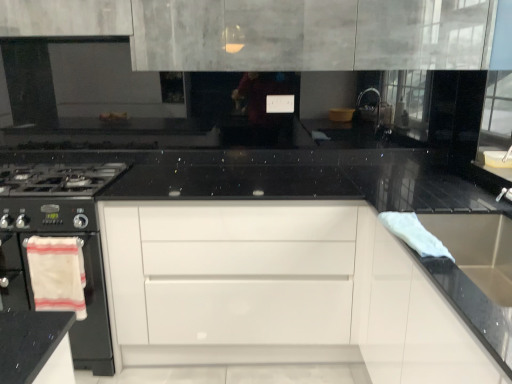
What is the approximate height of white cotton towel at left, which is the second material in right-to-left order?

The height of white cotton towel at left, which is the second material in right-to-left order, is 15.21 inches.

Locate an element on the screen. white glossy drawer at center is located at coordinates (249, 274).

Consider the image. Which object is thinner, white glossy drawer at center or stainless steel sink at right?

stainless steel sink at right.

Is white glossy drawer at center taller than stainless steel sink at right?

Correct, white glossy drawer at center is much taller as stainless steel sink at right.

Would you consider white glossy drawer at center to be distant from stainless steel sink at right?

No, there isn't a large distance between white glossy drawer at center and stainless steel sink at right.

Could you tell me if white glossy drawer at center is facing stainless steel sink at right?

No, white glossy drawer at center is not aimed at stainless steel sink at right.

In the scene shown: Is black matte gas stove at left next to white glossy drawer at center and touching it?

black matte gas stove at left is not next to white glossy drawer at center, and they're not touching.

Is black matte gas stove at left positioned before white glossy drawer at center?

Yes, it is.

Could you tell me if black matte gas stove at left is facing white glossy drawer at center?

No, black matte gas stove at left is not turned towards white glossy drawer at center.

Considering the sizes of objects black matte gas stove at left and white glossy drawer at center in the image provided, who is bigger, black matte gas stove at left or white glossy drawer at center?

white glossy drawer at center.

Is white cloth at right, the 2th material when ordered from left to right, positioned with its back to white glossy drawer at center?

No, white cloth at right, the 2th material when ordered from left to right, is not facing the opposite direction of white glossy drawer at center.

Consider the image. From a real-world perspective, is white cloth at right, the 1th material from the right, over white glossy drawer at center?

Yes.

Considering the relative positions of white cloth at right, the 1th material when ordered from front to back, and white glossy drawer at center in the image provided, is white cloth at right, the 1th material when ordered from front to back, to the left of white glossy drawer at center from the viewer's perspective?

No.

Can you confirm if white cloth at right, the 1th material when ordered from front to back, is bigger than white glossy drawer at center?

No.

Is white cloth at right, marked as the second material in a bottom-to-top arrangement, smaller than black matte gas stove at left?

Correct, white cloth at right, marked as the second material in a bottom-to-top arrangement, occupies less space than black matte gas stove at left.

Consider the image. From the image's perspective, relative to black matte gas stove at left, is white cloth at right, the 1th material from the right, above or below?

Based on their image positions, white cloth at right, the 1th material from the right, is located beneath black matte gas stove at left.

How different are the orientations of white cloth at right, the 1th material when ordered from front to back, and black matte gas stove at left in degrees?

90.6 degrees separate the facing orientations of white cloth at right, the 1th material when ordered from front to back, and black matte gas stove at left.

Is point (404, 232) behind point (21, 211)?

That is False.

From the picture: Is white glossy drawer at center next to white cotton towel at left, the 2th material viewed from the top?

No.

Is white glossy drawer at center behind white cotton towel at left, the 2th material viewed from the top?

Yes, white glossy drawer at center is further from the viewer.

From the image's perspective, is white glossy drawer at center positioned above or below white cotton towel at left, positioned as the 1th material in bottom-to-top order?

From the image's perspective, white glossy drawer at center appears above white cotton towel at left, positioned as the 1th material in bottom-to-top order.

From a real-world perspective, who is located lower, stainless steel sink at right or white glossy drawer at center?

white glossy drawer at center is physically lower.

Is stainless steel sink at right wider or thinner than white glossy drawer at center?

In the image, stainless steel sink at right appears to be more narrow than white glossy drawer at center.

Is stainless steel sink at right oriented away from white glossy drawer at center?

No, stainless steel sink at right is not facing the opposite direction of white glossy drawer at center.

From the picture: Does stainless steel sink at right touch white cotton towel at left, which is the second material from front to back?

stainless steel sink at right and white cotton towel at left, which is the second material from front to back, are clearly separated.

Considering the sizes of objects stainless steel sink at right and white cotton towel at left, the 2th material viewed from the top, in the image provided, who is taller, stainless steel sink at right or white cotton towel at left, the 2th material viewed from the top,?

white cotton towel at left, the 2th material viewed from the top.

Can you confirm if stainless steel sink at right is thinner than white cotton towel at left, which is the second material in right-to-left order?

In fact, stainless steel sink at right might be wider than white cotton towel at left, which is the second material in right-to-left order.

Between stainless steel sink at right and white cotton towel at left, the 2th material viewed from the top, which one appears on the right side from the viewer's perspective?

From the viewer's perspective, stainless steel sink at right appears more on the right side.

The height and width of the screenshot is (384, 512). Find the location of `sink in front of the white glossy drawer at center`. sink in front of the white glossy drawer at center is located at coordinates (478, 249).

Locate an element on the screen. This screenshot has height=384, width=512. drawer below the black matte gas stove at left (from a real-world perspective) is located at coordinates (249, 274).

When comparing their distances from white cotton towel at left, positioned as the 1th material in bottom-to-top order, does white cloth at right, which is the second material from back to front, or white glossy drawer at center seem closer?

The object closer to white cotton towel at left, positioned as the 1th material in bottom-to-top order, is white glossy drawer at center.

Looking at the image, which one is located closer to white glossy drawer at center, black matte gas stove at left or white cloth at right, the 1th material viewed from the top?

Based on the image, black matte gas stove at left appears to be nearer to white glossy drawer at center.

When comparing their distances from white cloth at right, the 1th material from the right, does black matte gas stove at left or stainless steel sink at right seem further?

The object further to white cloth at right, the 1th material from the right, is black matte gas stove at left.

Which object lies nearer to the anchor point black matte gas stove at left, white glossy drawer at center or white cotton towel at left, acting as the first material starting from the back?

white cotton towel at left, acting as the first material starting from the back.

From the image, which object appears to be nearer to white cloth at right, the 1th material viewed from the top, white glossy drawer at center or white cotton towel at left, the 2th material viewed from the top?

white glossy drawer at center lies closer to white cloth at right, the 1th material viewed from the top, than the other object.

Considering their positions, is black matte gas stove at left positioned closer to white glossy drawer at center than stainless steel sink at right?

Based on the image, black matte gas stove at left appears to be nearer to white glossy drawer at center.

When comparing their distances from stainless steel sink at right, does white cotton towel at left, positioned as the first material in left-to-right order, or black matte gas stove at left seem further?

white cotton towel at left, positioned as the first material in left-to-right order, is positioned further to the anchor stainless steel sink at right.

When comparing their distances from stainless steel sink at right, does white cloth at right, the 1th material viewed from the top, or white cotton towel at left, positioned as the first material in left-to-right order, seem further?

Among the two, white cotton towel at left, positioned as the first material in left-to-right order, is located further to stainless steel sink at right.

Locate an element on the screen. material between black matte gas stove at left and white cloth at right, the 1th material when ordered from front to back, in the horizontal direction is located at coordinates (57, 274).

Locate an element on the screen. drawer between black matte gas stove at left and stainless steel sink at right from left to right is located at coordinates (249, 274).

Image resolution: width=512 pixels, height=384 pixels. Find the location of `drawer situated between white cotton towel at left, which is the second material in right-to-left order, and stainless steel sink at right from left to right`. drawer situated between white cotton towel at left, which is the second material in right-to-left order, and stainless steel sink at right from left to right is located at coordinates (249, 274).

This screenshot has width=512, height=384. I want to click on drawer situated between white cotton towel at left, which is the second material in right-to-left order, and white cloth at right, which is the second material from back to front, from left to right, so pos(249,274).